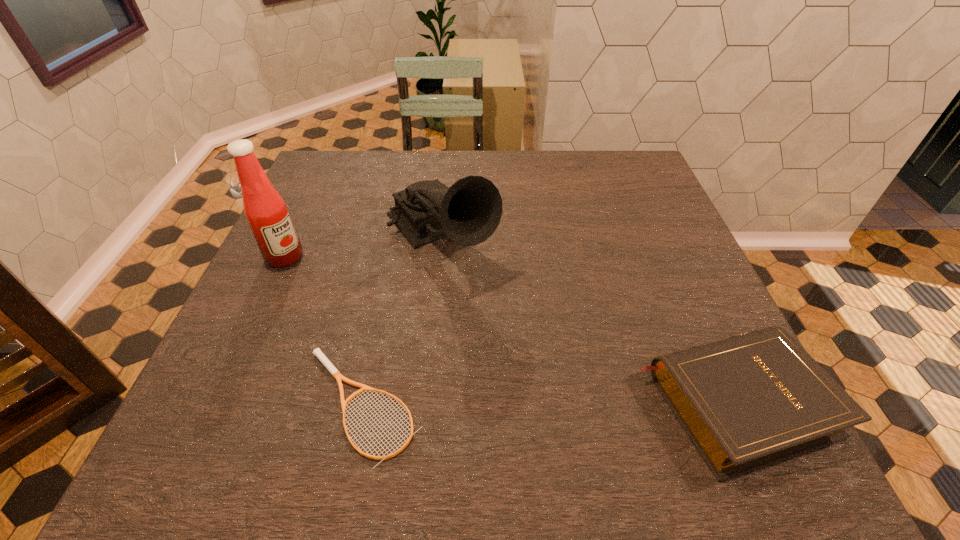
This screenshot has width=960, height=540. I want to click on tennis racket, so click(x=330, y=367).

You are a GUI agent. You are given a task and a screenshot of the screen. Output one action in this format:
    pyautogui.click(x=<x>, y=<y>)
    Task: Click on the Bible
    The width and height of the screenshot is (960, 540).
    Given the screenshot: What is the action you would take?
    pyautogui.click(x=748, y=401)

Where is `the third tallest object`? The image size is (960, 540). the third tallest object is located at coordinates (748, 401).

Locate an element on the screen. This screenshot has height=540, width=960. condiment is located at coordinates (266, 212).

The height and width of the screenshot is (540, 960). Identify the location of the second tallest object. (468, 212).

Locate an element on the screen. vacant space located on the back of the tennis racket is located at coordinates (385, 295).

At what (x,y) coordinates should I click in order to perform the action: click on vacant space positioned on the back of the Bible. Please return your answer as a coordinate pair (x, y). This screenshot has height=540, width=960. Looking at the image, I should click on (657, 228).

Find the location of a particular element. Image resolution: width=960 pixels, height=540 pixels. free space located 0.370m on the front-facing side of the leftmost object is located at coordinates (409, 341).

Where is `free region located on the front-facing side of the leftmost object`? The image size is (960, 540). free region located on the front-facing side of the leftmost object is located at coordinates (355, 305).

This screenshot has width=960, height=540. Find the location of `blank space located 0.320m on the front-facing side of the leftmost object`. blank space located 0.320m on the front-facing side of the leftmost object is located at coordinates 392,329.